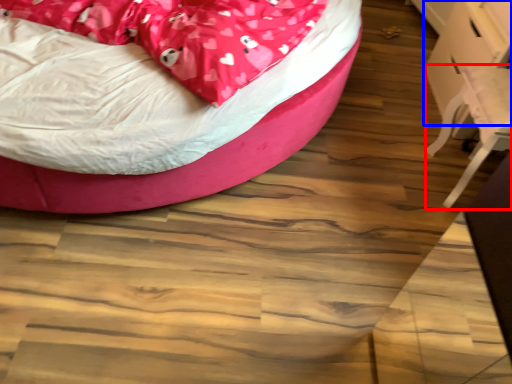
Question: Which object appears farthest to the camera in this image, swivel chair (highlighted by a red box) or table (highlighted by a blue box)?

Choices:
 (A) swivel chair
 (B) table

Answer: (B)